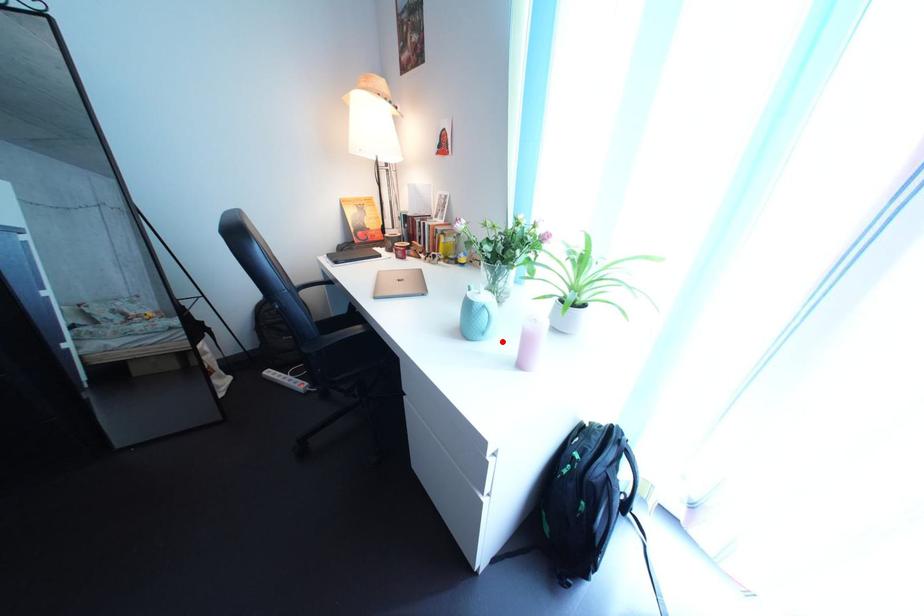
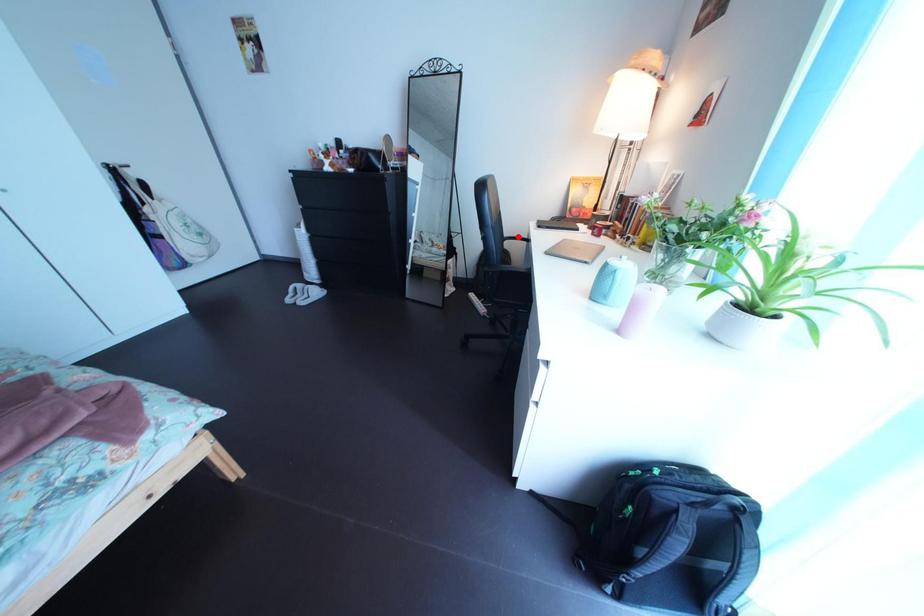
I am providing you with two images of the same scene from different viewpoints. A red point is marked on the first image and another point is marked on the second image. Does the point marked in image1 correspond to the same location as the one in image2?

No